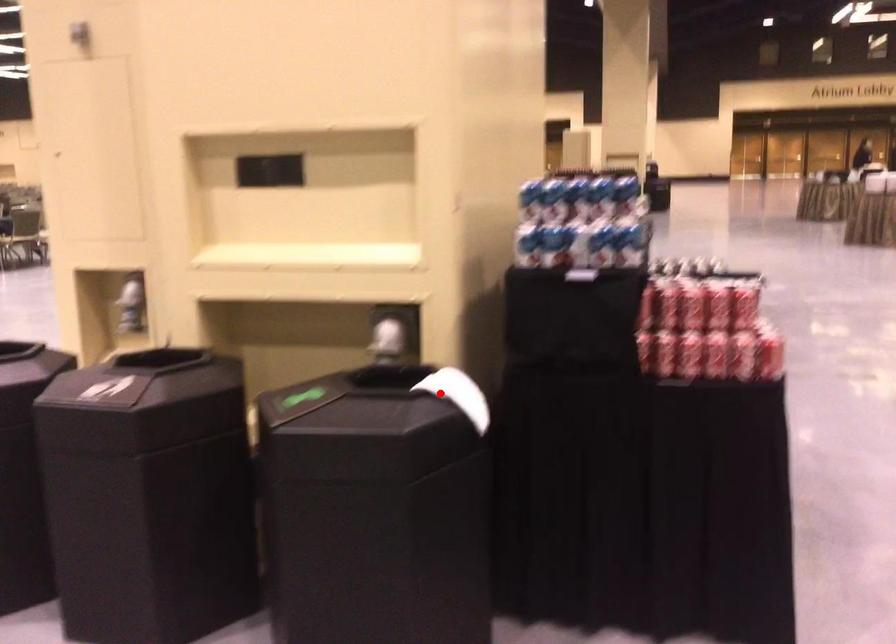
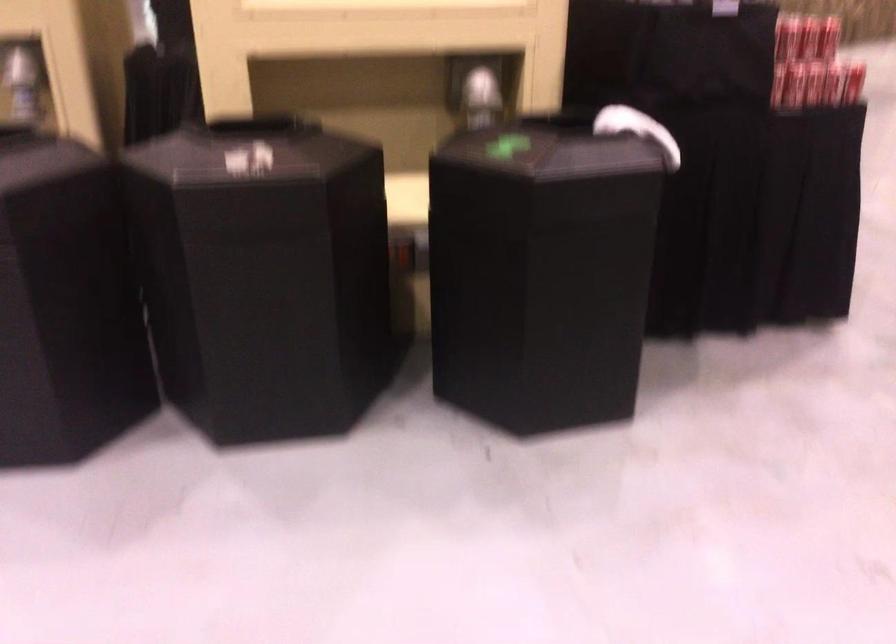
Locate, in the second image, the point that corresponds to the highlighted location in the first image.

(636, 129)